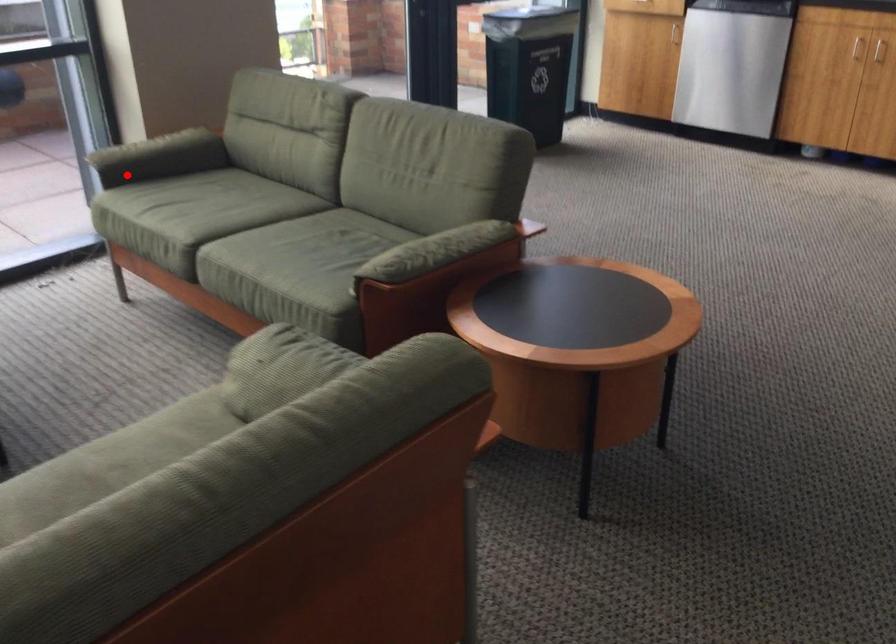
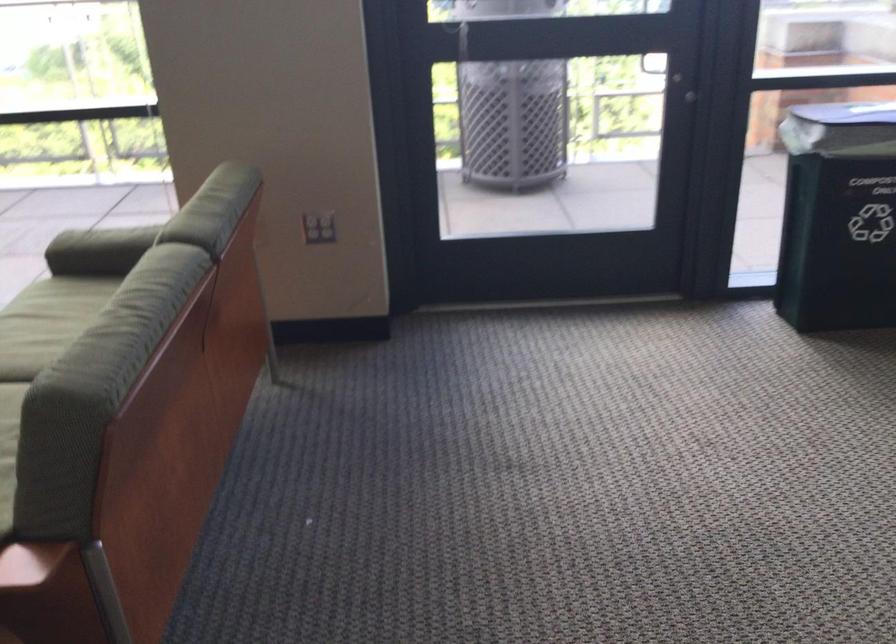
Question: I am providing you with two images of the same scene from different viewpoints. In image1, a red point is highlighted. Considering the same 3D point in image2, which of the following is correct?

Choices:
 (A) It is closer
 (B) It is farther

Answer: (A)